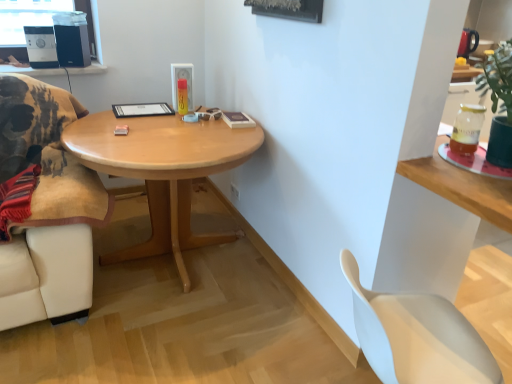
Locate an element on the screen. Image resolution: width=512 pixels, height=384 pixels. free spot above light wood/finish coffee table at center (from a real-world perspective) is located at coordinates [176, 125].